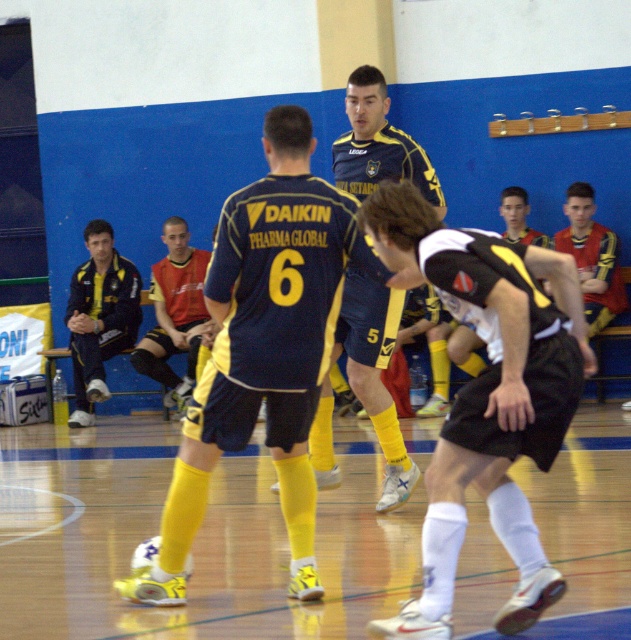
In the scene shown: You are a referee in the futsal match and need to check if the white matte jersey at center is properly worn over the matte blue shorts at center. Based on the scene description, is the jersey positioned correctly?

The white matte jersey at center is above the matte blue shorts at center, so it is properly worn over the shorts.

You are a referee in the futsal match and need to determine if the matte blue jersey at center is above or below the red jersey at center. Based on the scene, what is the correct position?

The matte blue jersey at center is below the red jersey at center.